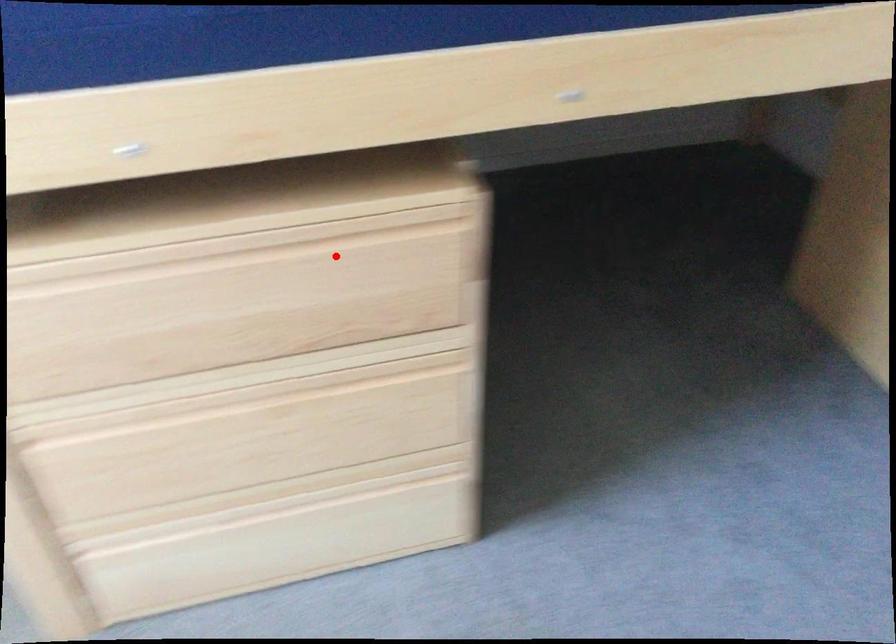
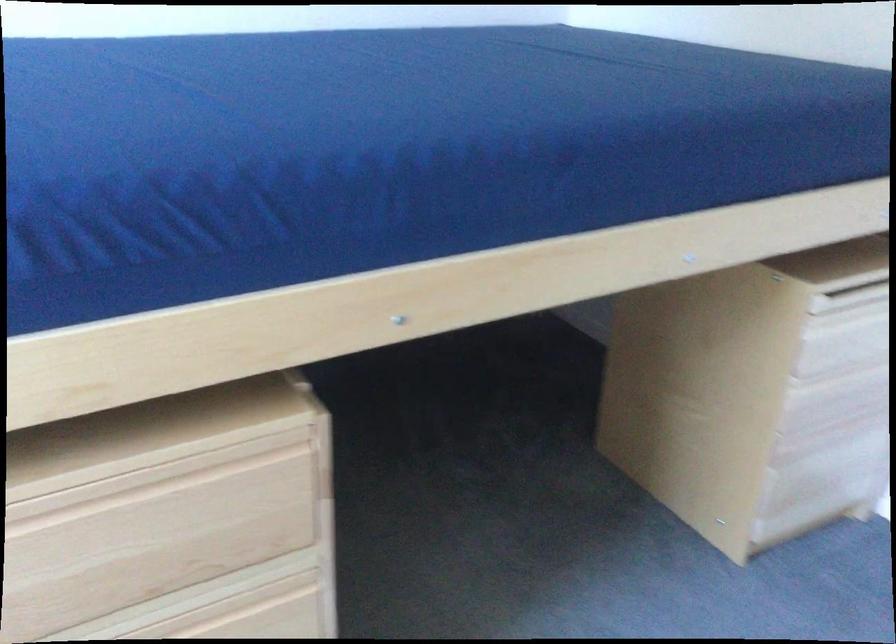
In the second image, find the point that corresponds to the highlighted location in the first image.

(174, 494)